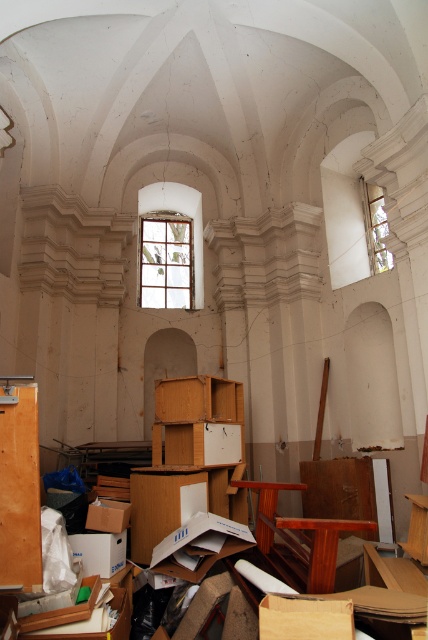
You are standing in the abandoned church and need to locate the clear glass window at upper right. Which direction should you look relative to the clear glass window at center?

The clear glass window at upper right is above the clear glass window at center, so you should look upward from the clear glass window at center to locate it.

You are standing inside the abandoned church and want to exit through one of the clear glass windows. Which window, the clear glass window at center or the clear glass window at upper right, is closer to you and thus easier to reach?

The clear glass window at center is closer to you than the clear glass window at upper right, so it is easier to reach.